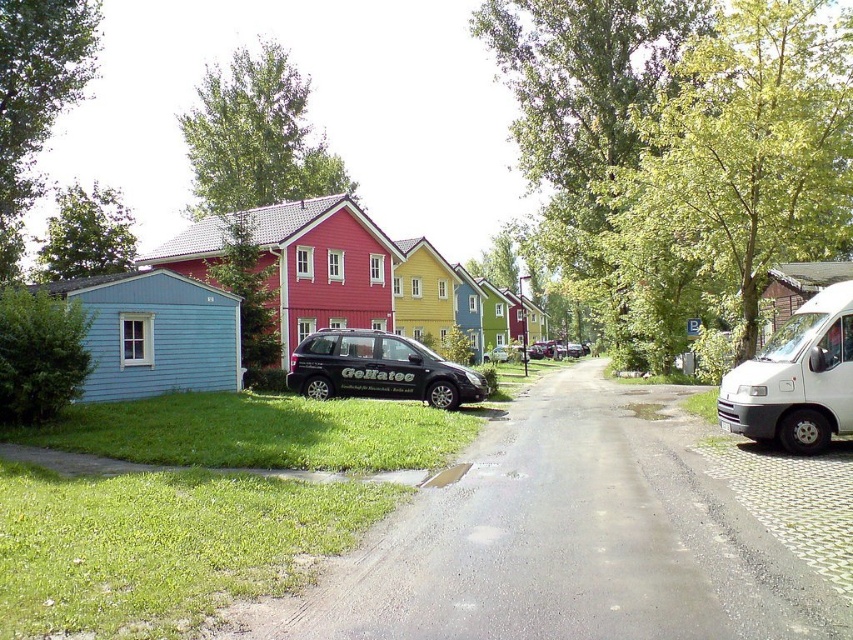
Consider the image. Is white matte van at right closer to the viewer compared to black matte minivan at center?

Yes.

Is point (831, 292) positioned in front of point (425, 394)?

Yes, point (831, 292) is in front of point (425, 394).

You are a GUI agent. You are given a task and a screenshot of the screen. Output one action in this format:
    pyautogui.click(x=<x>, y=<y>)
    Task: Click on the white matte van at right
    The width and height of the screenshot is (853, 640).
    Given the screenshot: What is the action you would take?
    pyautogui.click(x=796, y=378)